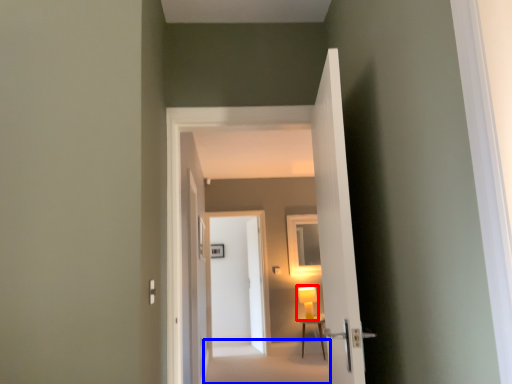
Question: Which point is further to the camera, table lamp (highlighted by a red box) or path (highlighted by a blue box)?

Choices:
 (A) table lamp
 (B) path

Answer: (A)